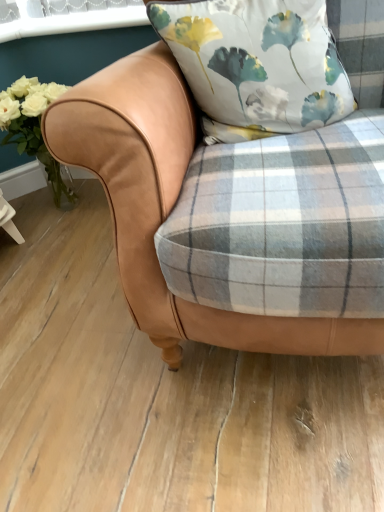
The width and height of the screenshot is (384, 512). Describe the element at coordinates (32, 126) in the screenshot. I see `white matte flowers at left` at that location.

Measure the distance between silky floral pillow at center and camera.

A distance of 34.29 inches exists between silky floral pillow at center and camera.

Measure the distance between point (218, 323) and camera.

Point (218, 323) and camera are 79.40 centimeters apart.

What is the approximate width of tan leather chair at center?

tan leather chair at center is 90.72 centimeters wide.

This screenshot has height=512, width=384. I want to click on white matte flowers at left, so click(32, 126).

How many degrees apart are the facing directions of tan leather chair at center and white matte flowers at left?

The angle between the facing direction of tan leather chair at center and the facing direction of white matte flowers at left is 0.000502 degrees.

Is tan leather chair at center closer to camera compared to white matte flowers at left?

Yes, tan leather chair at center is closer to the camera.

From a real-world perspective, is tan leather chair at center positioned under white matte flowers at left based on gravity?

No, from a real-world perspective, tan leather chair at center is not below white matte flowers at left.

This screenshot has height=512, width=384. Identify the location of chair in front of the white matte flowers at left. (168, 207).

From a real-world perspective, is white plastic window screen at upper left on top of white matte flowers at left?

Yes, from a real-world perspective, white plastic window screen at upper left is on top of white matte flowers at left.

Based on the photo, who is smaller, white plastic window screen at upper left or white matte flowers at left?

white plastic window screen at upper left.

Considering the positions of point (19, 1) and point (17, 127), is point (19, 1) closer or farther from the camera than point (17, 127)?

Point (19, 1) is positioned farther from the camera compared to point (17, 127).

Is white plastic window screen at upper left in front of white matte flowers at left?

That is False.

Is silky floral pillow at center spatially inside white matte flowers at left, or outside of it?

silky floral pillow at center is spatially situated outside white matte flowers at left.

Is silky floral pillow at center smaller than white matte flowers at left?

Yes.

Does silky floral pillow at center have a lesser width compared to white matte flowers at left?

Yes, silky floral pillow at center is thinner than white matte flowers at left.

How different are the orientations of silky floral pillow at center and white matte flowers at left in degrees?

The angle between the facing direction of silky floral pillow at center and the facing direction of white matte flowers at left is 18.6 degrees.

Is tan leather chair at center turned away from silky floral pillow at center?

Absolutely, tan leather chair at center is directed away from silky floral pillow at center.

What's the angular difference between tan leather chair at center and silky floral pillow at center's facing directions?

The angle between the facing direction of tan leather chair at center and the facing direction of silky floral pillow at center is 18.6 degrees.

Which object is further away from the camera taking this photo, tan leather chair at center or silky floral pillow at center?

silky floral pillow at center is further away from the camera.

Is tan leather chair at center far from silky floral pillow at center?

No, tan leather chair at center is not far from silky floral pillow at center.

From a real-world perspective, which object rests below the other?

From a 3D spatial view, white matte flowers at left is below.

Based on the photo, which point is more distant from viewer, [30,85] or [197,79]?

The point [30,85] is behind.

Which of these two, white matte flowers at left or silky floral pillow at center, stands shorter?

With less height is silky floral pillow at center.

Can you see white matte flowers at left touching silky floral pillow at center?

No.

Is white plastic window screen at upper left spatially inside tan leather chair at center, or outside of it?

white plastic window screen at upper left is located beyond the bounds of tan leather chair at center.

How different are the orientations of white plastic window screen at upper left and tan leather chair at center in degrees?

0.999 degrees separate the facing orientations of white plastic window screen at upper left and tan leather chair at center.

Does point (127, 15) appear closer or farther from the camera than point (59, 141)?

Point (127, 15) appears to be farther away from the viewer than point (59, 141).

Are white plastic window screen at upper left and tan leather chair at center beside each other?

white plastic window screen at upper left and tan leather chair at center are clearly separated.

Based on the photo, would you say silky floral pillow at center contains tan leather chair at center?

That's incorrect, tan leather chair at center is not inside silky floral pillow at center.

Is there a large distance between silky floral pillow at center and tan leather chair at center?

Actually, silky floral pillow at center and tan leather chair at center are a little close together.

In the image, there is a silky floral pillow at center. At what (x,y) coordinates should I click in order to perform the action: click on chair below it (from a real-world perspective). Please return your answer as a coordinate pair (x, y). This screenshot has width=384, height=512. Looking at the image, I should click on (168, 207).

Considering the points (313, 92) and (146, 147), which point is behind, point (313, 92) or point (146, 147)?

The point (313, 92) is behind.

This screenshot has width=384, height=512. I want to click on chair that appears on the right of white matte flowers at left, so click(168, 207).

I want to click on floral arrangement located underneath the white plastic window screen at upper left (from a real-world perspective), so click(x=32, y=126).

Considering their positions, is white plastic window screen at upper left positioned closer to white matte flowers at left than tan leather chair at center?

white plastic window screen at upper left is closer to white matte flowers at left.

When comparing their distances from silky floral pillow at center, does tan leather chair at center or white matte flowers at left seem further?

The object further to silky floral pillow at center is white matte flowers at left.

Considering their positions, is white matte flowers at left positioned closer to silky floral pillow at center than tan leather chair at center?

tan leather chair at center is closer to silky floral pillow at center.

Which object lies further to the anchor point tan leather chair at center, white plastic window screen at upper left or silky floral pillow at center?

Based on the image, white plastic window screen at upper left appears to be further to tan leather chair at center.

Estimate the real-world distances between objects in this image. Which object is further from silky floral pillow at center, white plastic window screen at upper left or white matte flowers at left?

white matte flowers at left lies further to silky floral pillow at center than the other object.

From the image, which object appears to be farther from white plastic window screen at upper left, white matte flowers at left or tan leather chair at center?

The object further to white plastic window screen at upper left is tan leather chair at center.

Based on their spatial positions, is silky floral pillow at center or white plastic window screen at upper left closer to white matte flowers at left?

white plastic window screen at upper left.

Estimate the real-world distances between objects in this image. Which object is further from tan leather chair at center, white matte flowers at left or white plastic window screen at upper left?

white plastic window screen at upper left.

Where is `pillow located between tan leather chair at center and white matte flowers at left in the depth direction`? This screenshot has width=384, height=512. pillow located between tan leather chair at center and white matte flowers at left in the depth direction is located at coordinates (257, 65).

Where is `floral arrangement between tan leather chair at center and white plastic window screen at upper left in the front-back direction`? floral arrangement between tan leather chair at center and white plastic window screen at upper left in the front-back direction is located at coordinates (32, 126).

Image resolution: width=384 pixels, height=512 pixels. I want to click on pillow positioned between tan leather chair at center and white plastic window screen at upper left from near to far, so click(x=257, y=65).

This screenshot has height=512, width=384. Identify the location of window screen between white matte flowers at left and silky floral pillow at center from left to right. (67, 17).